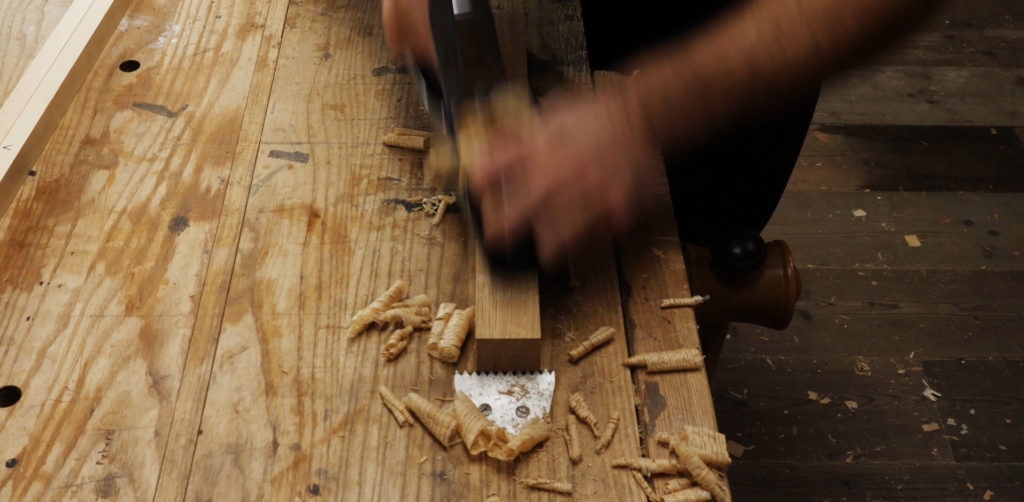
Locate an element on the screen. The height and width of the screenshot is (502, 1024). screws is located at coordinates [x=481, y=408], [x=523, y=410].